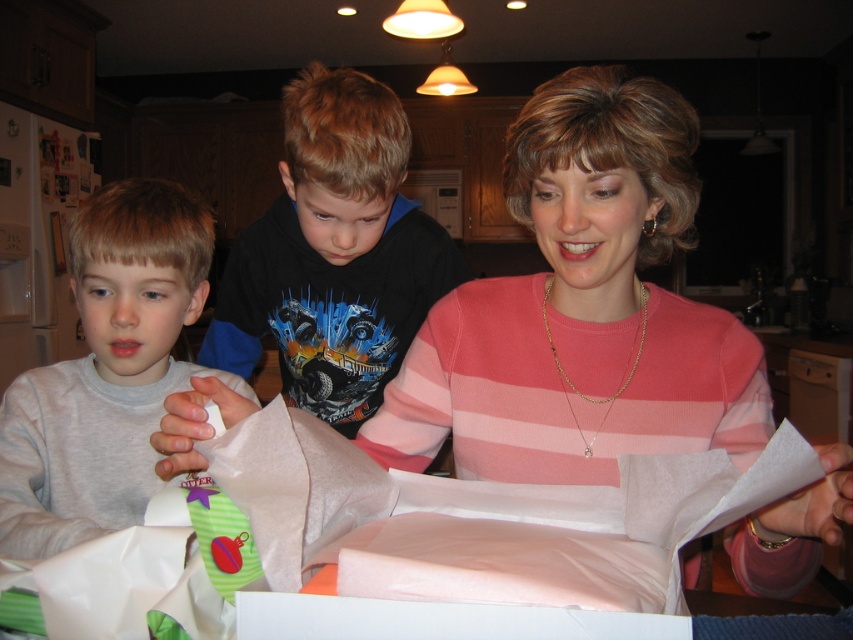
How far apart are black cotton shirt at center and gray cotton shirt at left?

The distance of black cotton shirt at center from gray cotton shirt at left is 31.44 centimeters.

Find the location of a particular element. The width and height of the screenshot is (853, 640). black cotton shirt at center is located at coordinates (334, 253).

The height and width of the screenshot is (640, 853). Describe the element at coordinates (581, 308) in the screenshot. I see `pink striped sweater at center` at that location.

Between pink striped sweater at center and gray cotton shirt at left, which one has more height?

pink striped sweater at center

Measure the distance between pink striped sweater at center and camera.

A distance of 20.12 inches exists between pink striped sweater at center and camera.

Identify the location of pink striped sweater at center. (581, 308).

Is pink striped sweater at center smaller than black cotton shirt at center?

Yes.

Can you confirm if pink striped sweater at center is thinner than black cotton shirt at center?

No.

What do you see at coordinates (581, 308) in the screenshot? I see `pink striped sweater at center` at bounding box center [581, 308].

Where is `pink striped sweater at center`? This screenshot has width=853, height=640. pink striped sweater at center is located at coordinates (581, 308).